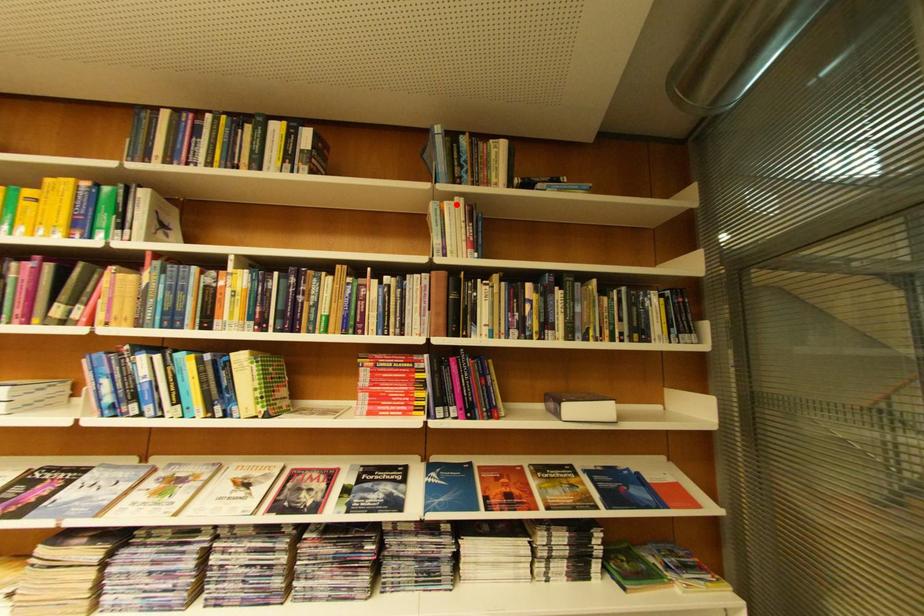
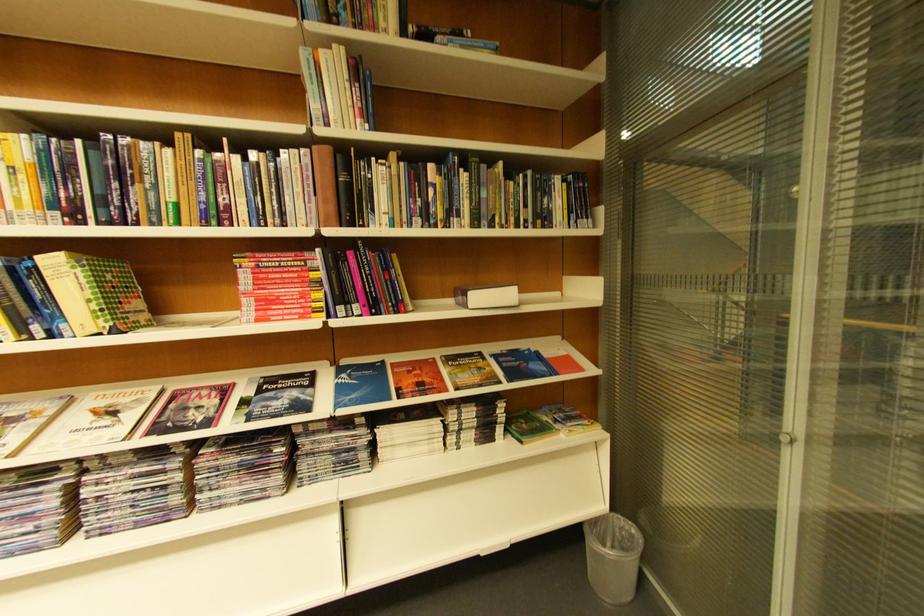
Where in the second image is the point corresponding to the highlighted location from the first image?

(332, 55)